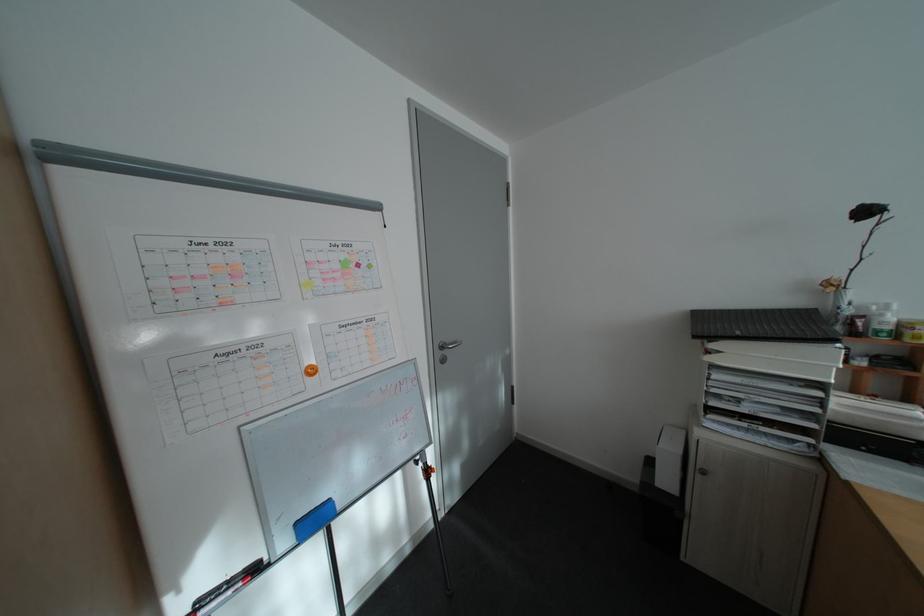
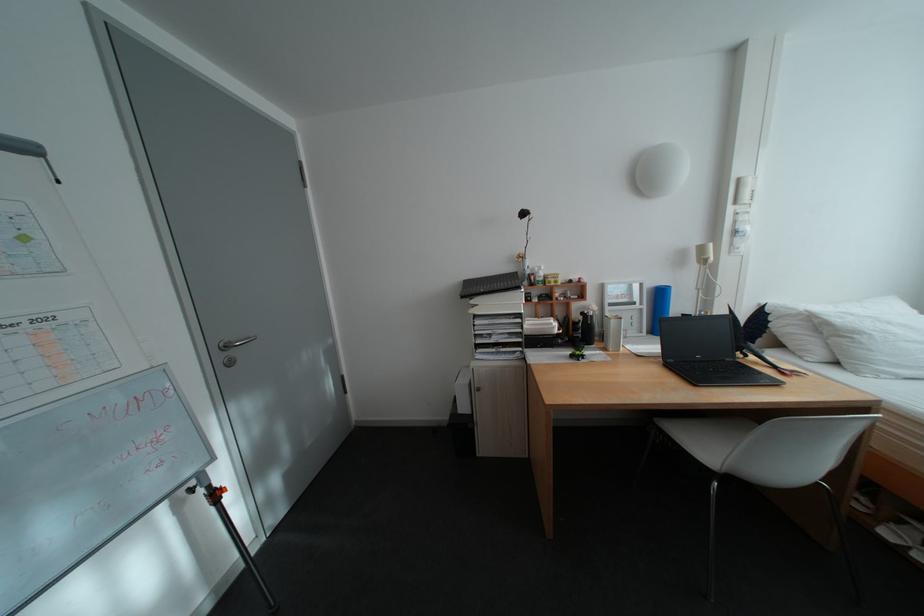
Locate, in the second image, the point that corresponds to point (452, 355) in the first image.

(234, 358)